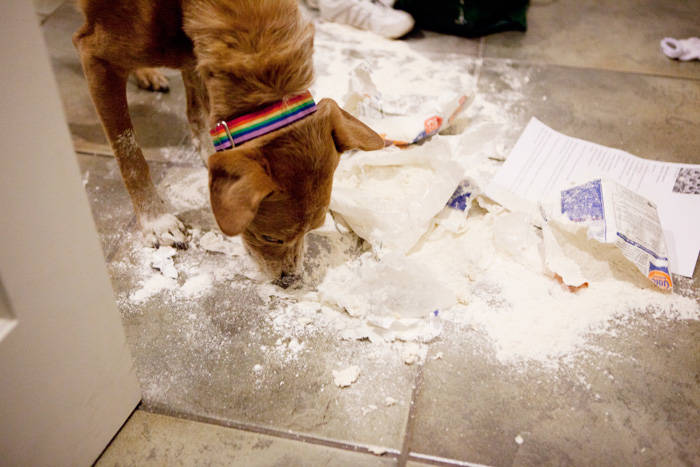
I want to click on floor, so (x=595, y=418), (x=612, y=33), (x=63, y=36).